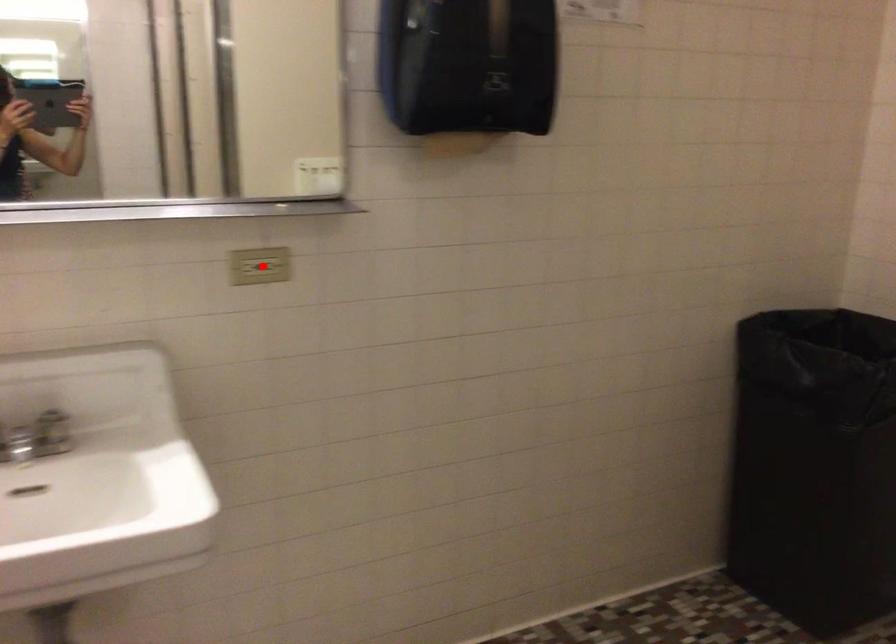
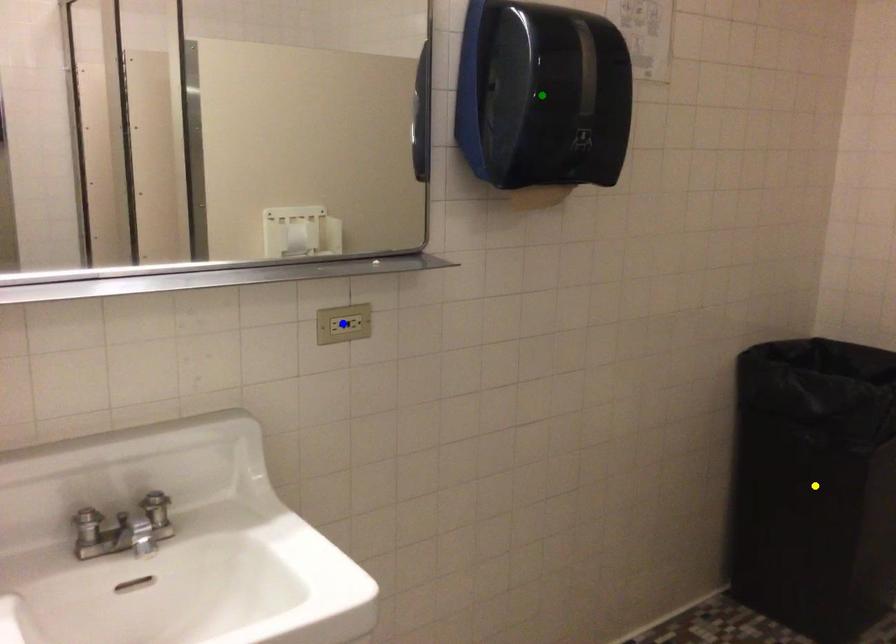
Question: I am providing you with two images of the same scene from different viewpoints. A red point is marked on the first image. You are given multiple points on the second image. Which point in image 2 is actually the same real-world point as the red point in image 1?

Choices:
 (A) yellow point
 (B) blue point
 (C) green point

Answer: (B)